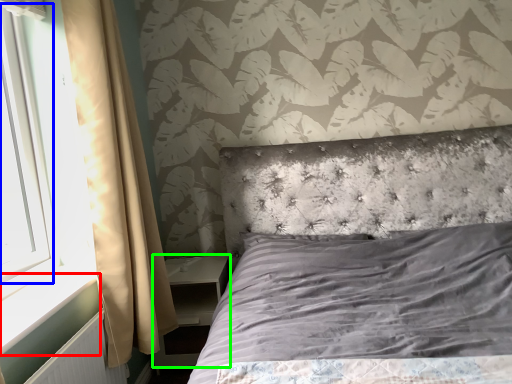
Question: Estimate the real-world distances between objects in this image. Which object is closer to window sill (highlighted by a red box), window screen (highlighted by a blue box) or nightstand (highlighted by a green box)?

Choices:
 (A) window screen
 (B) nightstand

Answer: (A)